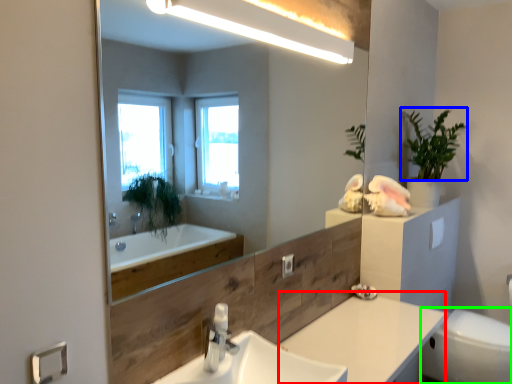
Question: Which object is positioned closest to counter top (highlighted by a red box)? Select from plant (highlighted by a blue box) and toilet bowl (highlighted by a green box).

Choices:
 (A) plant
 (B) toilet bowl

Answer: (B)